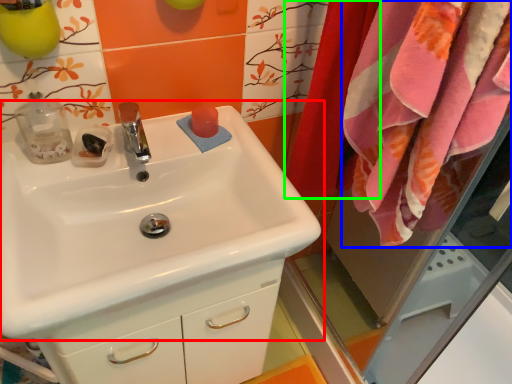
Question: Which object is the closest to the sink (highlighted by a red box)? Choose among these: bath towel (highlighted by a blue box) or curtain (highlighted by a green box).

Choices:
 (A) bath towel
 (B) curtain

Answer: (A)